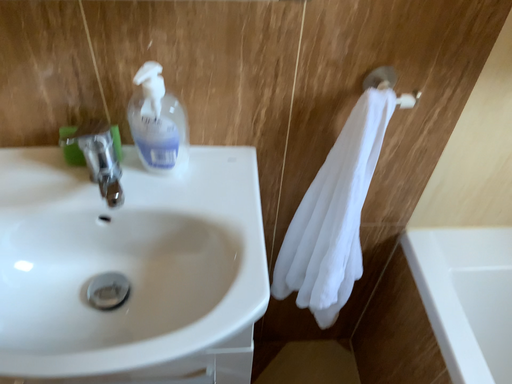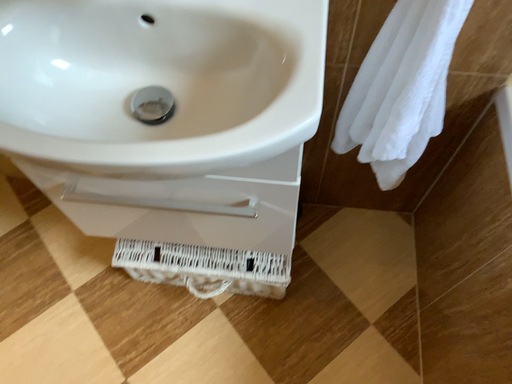
Question: Which way did the camera rotate in the video?

Choices:
 (A) rotated left
 (B) rotated right

Answer: (A)